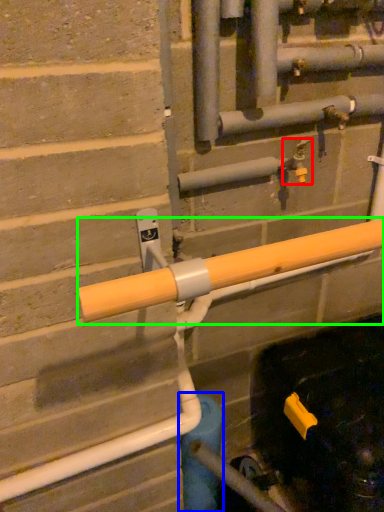
Question: Based on their relative distances, which object is nearer to plumbing fixture (highlighted by a red box)? Choose from water pipe (highlighted by a blue box) and beam (highlighted by a green box).

Choices:
 (A) water pipe
 (B) beam

Answer: (B)